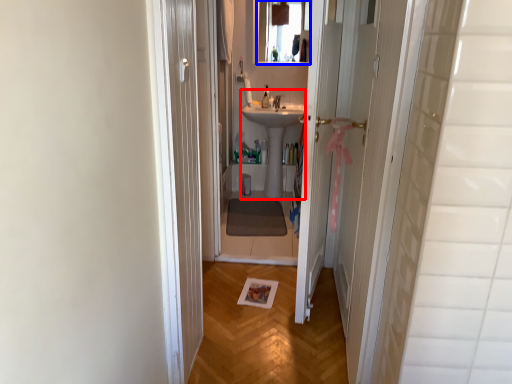
Question: Among these objects, which one is nearest to the camera, sink (highlighted by a red box) or mirror (highlighted by a blue box)?

Choices:
 (A) sink
 (B) mirror

Answer: (A)